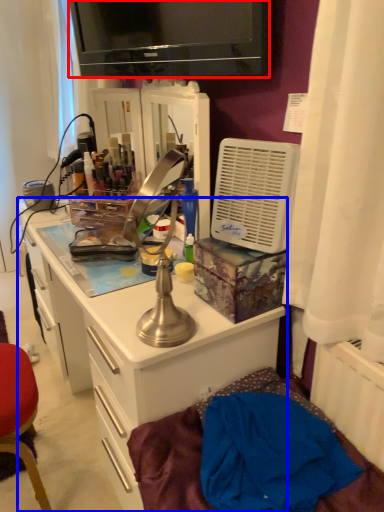
Question: Among these objects, which one is nearest to the camera, television (highlighted by a red box) or cabinetry (highlighted by a blue box)?

Choices:
 (A) television
 (B) cabinetry

Answer: (A)